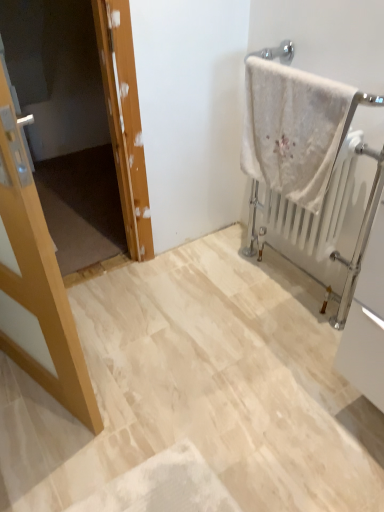
Image resolution: width=384 pixels, height=512 pixels. I want to click on free spot in front of white metallic radiator at right, so click(x=278, y=352).